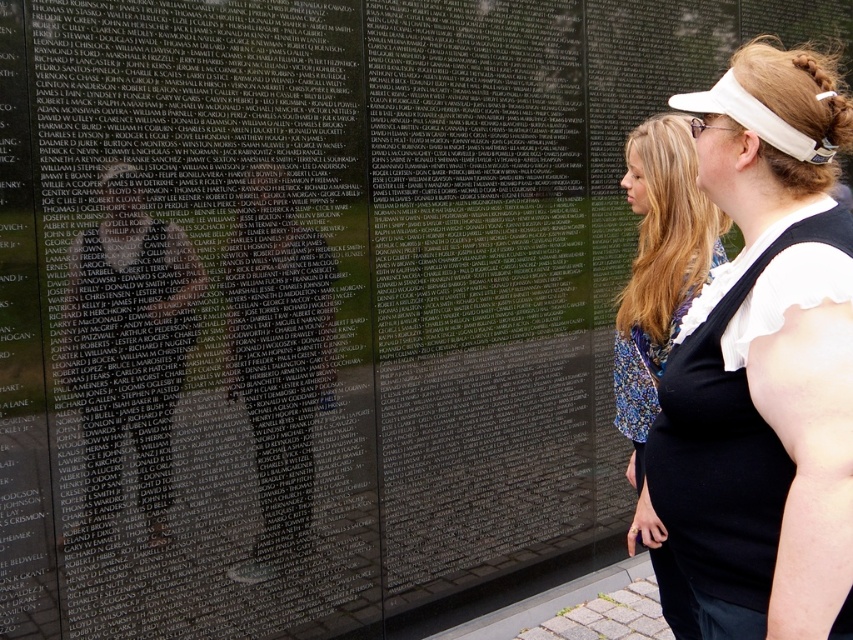
You are trying to determine the clothing and features of the people in the image. Based on the scene, which object is taller, the matte black dress at center or the blonde hair at upper center?

The matte black dress at center is much taller than the blonde hair at upper center.

You are a photographer trying to capture a clear shot of the matte white visor at upper right and the blonde hair at upper center. Based on their positions, which object is closer to the bottom edge of the photo?

The matte white visor at upper right is below blonde hair at upper center, so it is closer to the bottom edge of the photo.